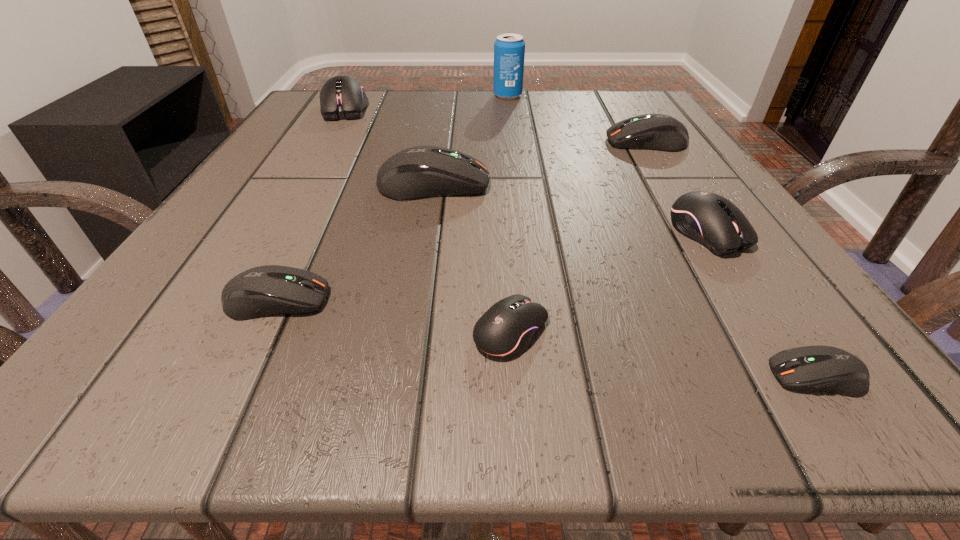
Find the location of a particular element. the fourth closest computer equipment to the leftmost black computer mouse is located at coordinates (506, 329).

Identify which computer equipment is the nearest to the rightmost black computer mouse. Please provide its 2D coordinates. Your answer should be formatted as a tuple, i.e. [(x, y)], where the tuple contains the x and y coordinates of a point satisfying the conditions above.

[(820, 368)]

I want to click on the third closest black computer mouse relative to the blue soda can, so click(x=506, y=329).

The image size is (960, 540). In order to click on black computer mouse that is the second closest to the farthest dark computer equipment in this screenshot , I will do `click(506, 329)`.

Identify which dark computer equipment is located as the third nearest to the leftmost dark computer equipment. Please provide its 2D coordinates. Your answer should be formatted as a tuple, i.e. [(x, y)], where the tuple contains the x and y coordinates of a point satisfying the conditions above.

[(659, 132)]

Select which dark computer equipment is the second closest to the fourth nearest computer equipment. Please provide its 2D coordinates. Your answer should be formatted as a tuple, i.e. [(x, y)], where the tuple contains the x and y coordinates of a point satisfying the conditions above.

[(659, 132)]

Where is `vacant space that satisfies the following two spatial constraints: 1. on the front side of the farthest computer equipment; 2. on the left side of the fifth farthest object`? This screenshot has width=960, height=540. vacant space that satisfies the following two spatial constraints: 1. on the front side of the farthest computer equipment; 2. on the left side of the fifth farthest object is located at coordinates (271, 232).

Image resolution: width=960 pixels, height=540 pixels. Identify the location of vacant space that satisfies the following two spatial constraints: 1. on the button of the second dark computer equipment from left to right; 2. on the right side of the rightmost black computer mouse. (426, 232).